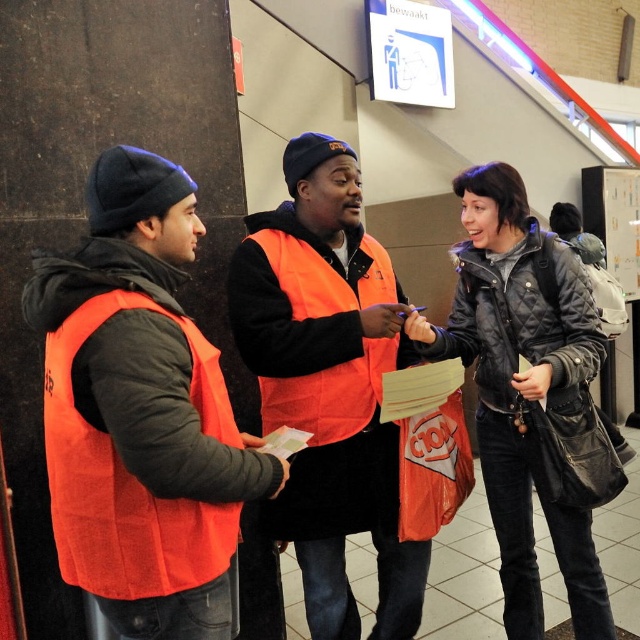
You are a passenger in the train station and see two staff members wearing orange vests. The first is wearing a matte orange vest at left, and the second is wearing an orange vest at center. If you want to ask for directions, which staff member is closer to the entrance located on the far left side of the station?

The matte orange vest at left is closer to the entrance located on the far left side of the station because it is positioned to the left of the orange vest at center.

You are a passenger at the station and need to locate the staff member wearing the orange vest at center. From your position facing the sign, which direction should you look relative to the quilted black jacket at right?

The orange vest at center is to the left of the quilted black jacket at right. So, you should look to the left side of the quilted black jacket at right to find the staff member wearing the orange vest at center.